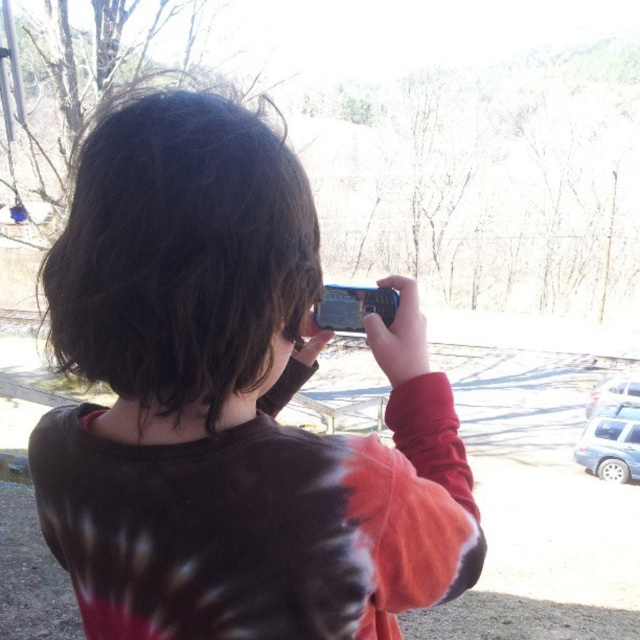
Question: Can you confirm if matte tie-dye shirt at center is positioned to the left of blue plastic smartphone at center?

Choices:
 (A) yes
 (B) no

Answer: (A)

Question: Can you confirm if matte tie-dye shirt at center is positioned below blue plastic smartphone at center?

Choices:
 (A) no
 (B) yes

Answer: (B)

Question: Which object is farther from the camera taking this photo?

Choices:
 (A) blue plastic smartphone at center
 (B) matte tie-dye shirt at center

Answer: (A)

Question: Which of the following is the farthest from the observer?

Choices:
 (A) matte tie-dye shirt at center
 (B) blue plastic smartphone at center

Answer: (B)

Question: Can you confirm if matte tie-dye shirt at center is positioned above blue plastic smartphone at center?

Choices:
 (A) no
 (B) yes

Answer: (A)